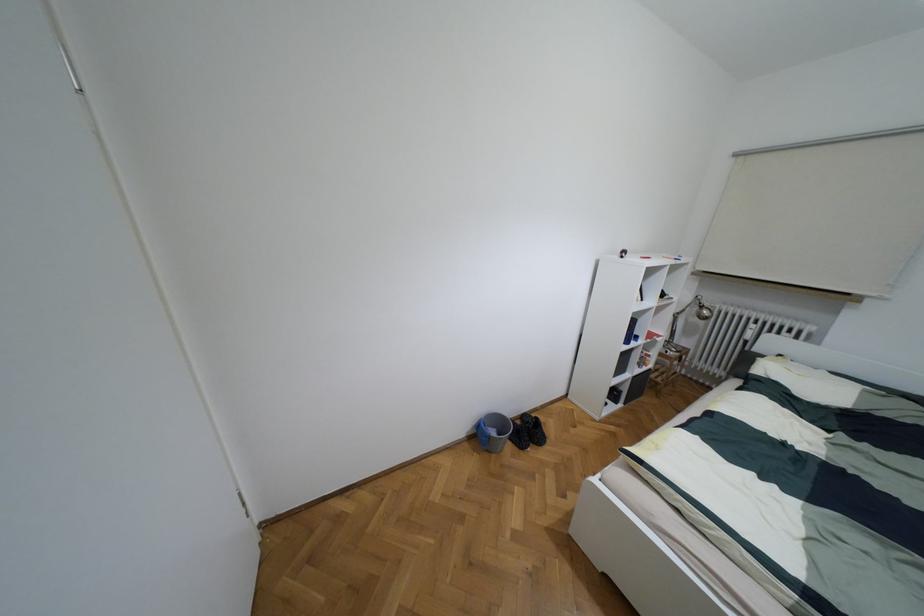
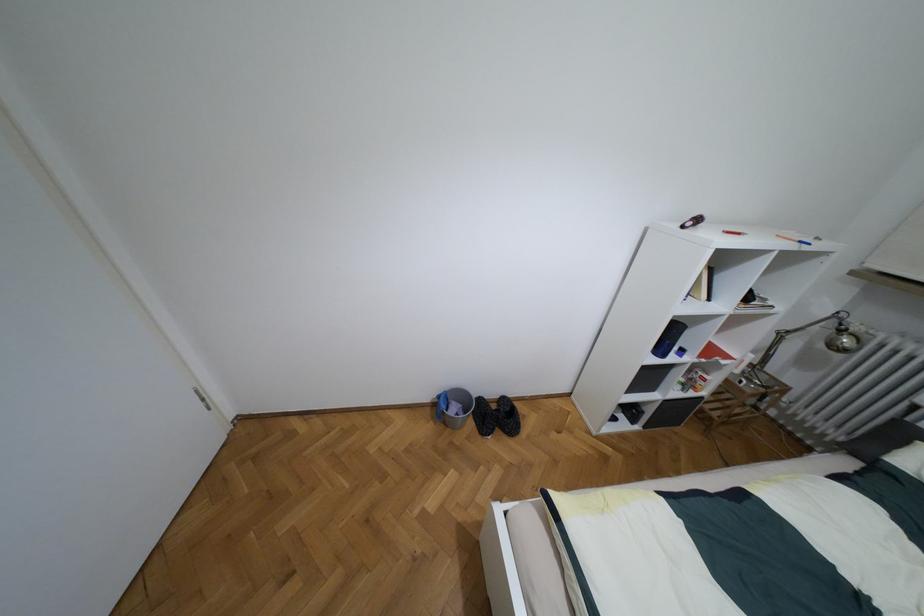
The point at (492, 432) is marked in the first image. Where is the corresponding point in the second image?

(453, 408)